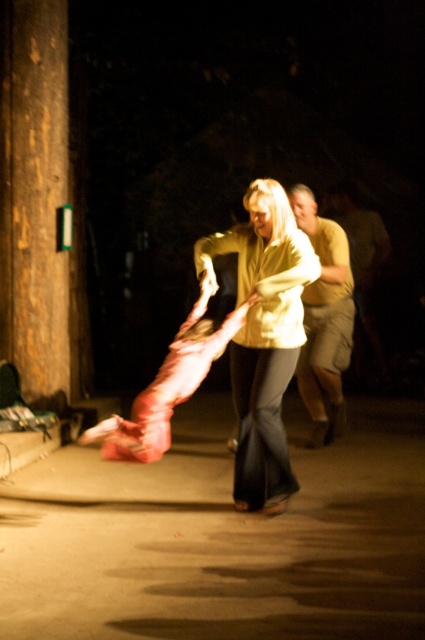
Question: Which point is closer to the camera?

Choices:
 (A) brown wood pillar at left
 (B) brown concrete pavement at center
 (C) light brown cotton shorts at right
 (D) matte yellow shirt at center

Answer: (B)

Question: Based on their relative distances, which object is nearer to the matte yellow shirt at center?

Choices:
 (A) brown concrete pavement at center
 (B) brown wood pillar at left

Answer: (A)

Question: Does brown wood pillar at left appear on the right side of matte yellow shirt at center?

Choices:
 (A) yes
 (B) no

Answer: (B)

Question: Is brown concrete pavement at center thinner than light brown cotton shorts at right?

Choices:
 (A) yes
 (B) no

Answer: (B)

Question: Does brown concrete pavement at center have a lesser width compared to matte yellow shirt at center?

Choices:
 (A) yes
 (B) no

Answer: (B)

Question: Which of the following is the closest to the observer?

Choices:
 (A) (50, 12)
 (B) (138, 564)
 (C) (311, 195)
 (D) (292, 276)

Answer: (B)